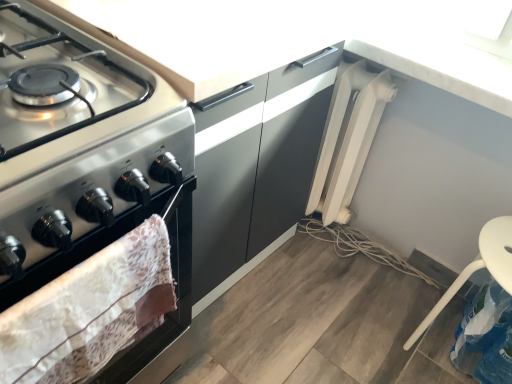
Question: Considering the positions of white plastic radiator at upper right and white plastic chair at lower right in the image, is white plastic radiator at upper right taller or shorter than white plastic chair at lower right?

Choices:
 (A) short
 (B) tall

Answer: (B)

Question: From a real-world perspective, is white plastic radiator at upper right physically located above or below white plastic chair at lower right?

Choices:
 (A) above
 (B) below

Answer: (A)

Question: Based on their relative distances, which object is farther from the matte silver oven at left?

Choices:
 (A) white plastic chair at lower right
 (B) white plastic radiator at lower right
 (C) white plastic radiator at upper right

Answer: (B)

Question: Which is nearer to the matte silver oven at left?

Choices:
 (A) white plastic radiator at upper right
 (B) white plastic radiator at lower right
 (C) white plastic chair at lower right

Answer: (C)